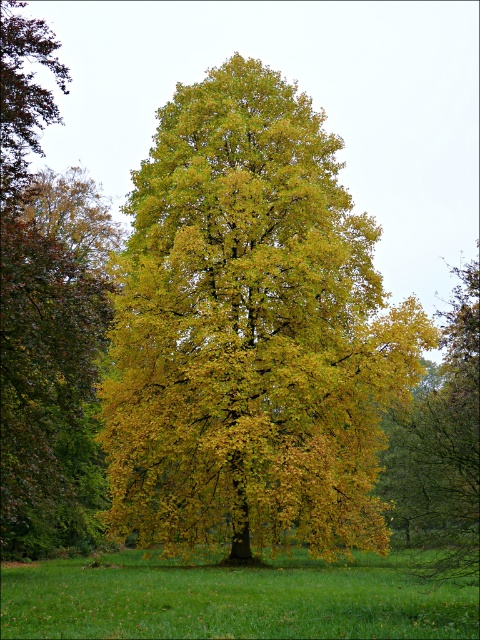
You are standing in the grassy area looking at the large tree. There are two points marked on the tree canopy. Which point is closer to you, point (84,296) or point (206,576)?

Point (84,296) is closer to the viewer than point (206,576).